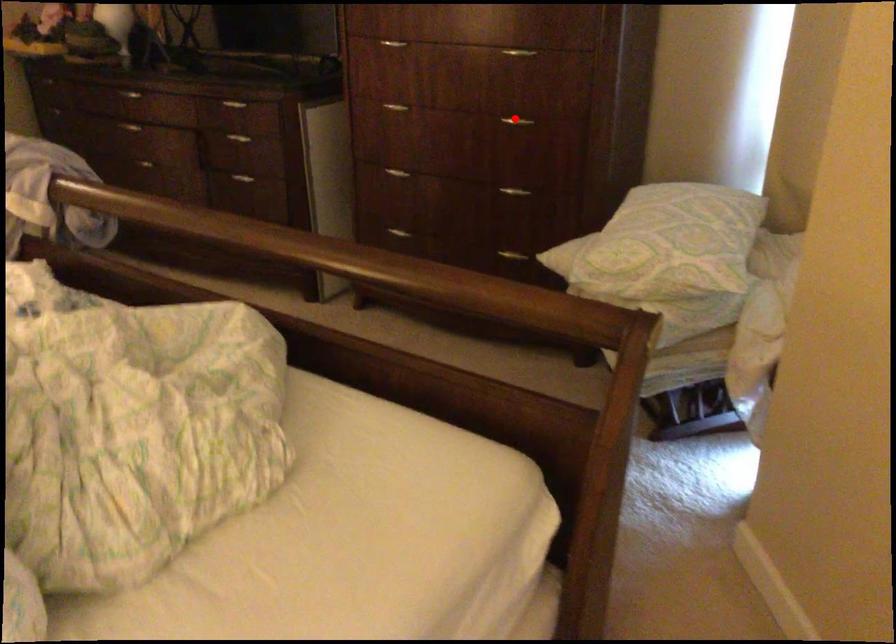
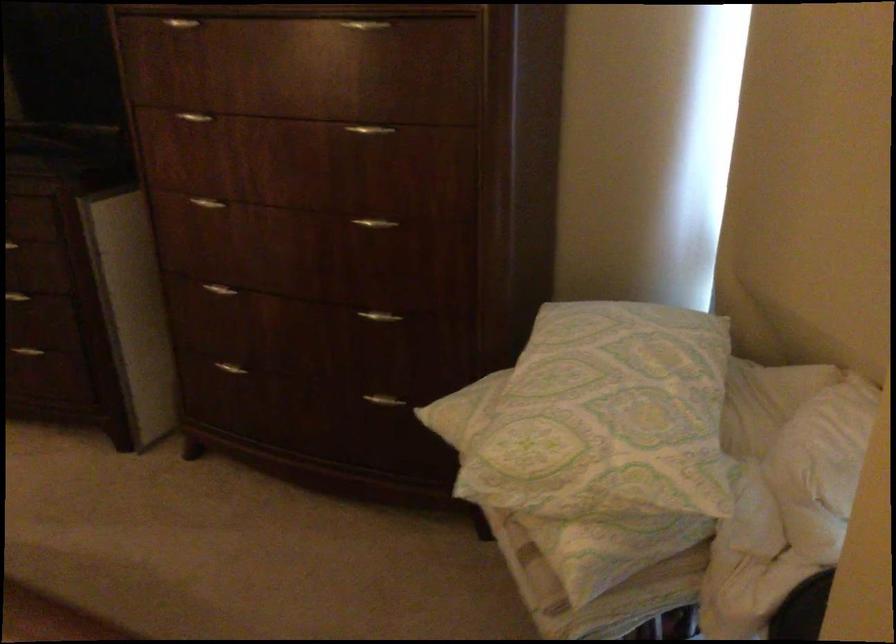
Question: I am providing you with two images of the same scene from different viewpoints. Image1 has a red point marked. In image2, the corresponding 3D location appears at what relative position? Reply with the corresponding letter.

Choices:
 (A) Closer
 (B) Farther

Answer: (A)